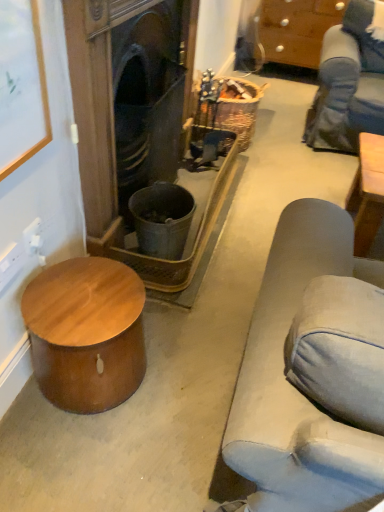
Locate an element on the screen. free space in front of wooden drum at lower left is located at coordinates (76, 458).